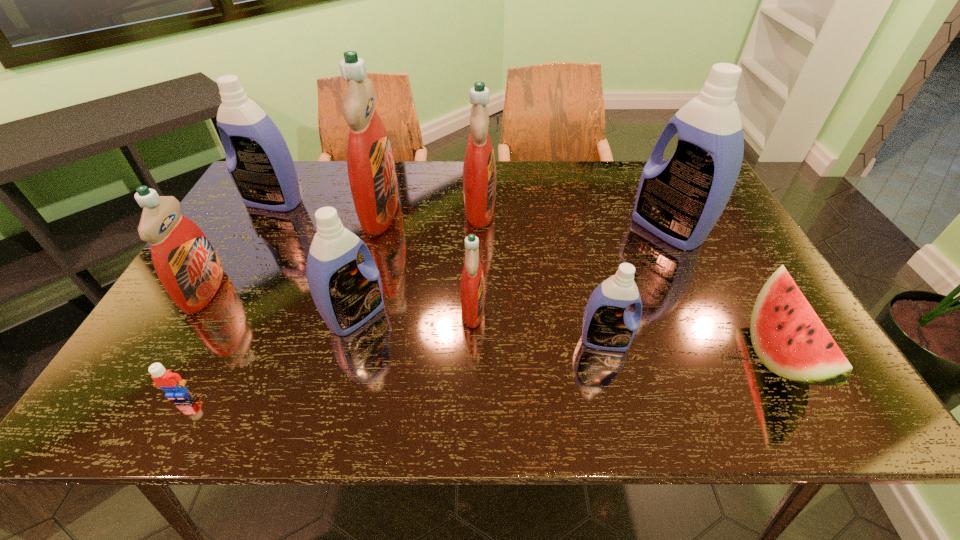
Locate an element on the screen. object situated at the far left corner is located at coordinates (261, 167).

I want to click on object that is positioned at the near left corner, so click(x=172, y=383).

Identify the location of object at the near right corner. The height and width of the screenshot is (540, 960). (x=788, y=337).

Identify the location of free space at the far edge of the desktop. (624, 179).

Find the location of a particular element. This screenshot has height=540, width=960. blank area at the near edge is located at coordinates (343, 394).

Image resolution: width=960 pixels, height=540 pixels. What are the coordinates of `free space at the left edge of the desktop` in the screenshot? It's located at (258, 217).

In the image, there is a desktop. Identify the location of free space at the right edge. The height and width of the screenshot is (540, 960). (726, 283).

Find the location of a particular element. This screenshot has width=960, height=540. free space between the biggest red detergent and the rightmost blue detergent is located at coordinates (524, 220).

The width and height of the screenshot is (960, 540). I want to click on vacant area that lies between the second biggest red detergent and the biggest red detergent, so click(x=430, y=210).

Locate an element on the screen. free space between the second blue detergent from left to right and the third biggest red detergent is located at coordinates coord(280,303).